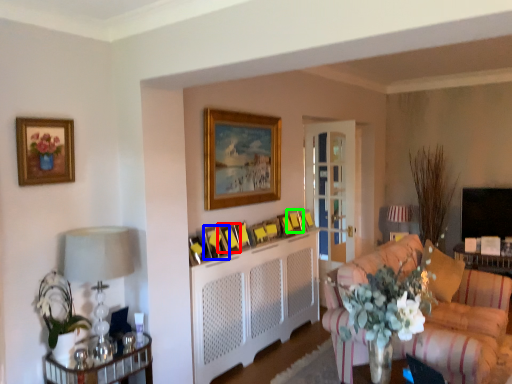
Question: Estimate the real-world distances between objects in this image. Which object is farther from picture frame (highlighted by a red box), picture frame (highlighted by a blue box) or picture frame (highlighted by a green box)?

Choices:
 (A) picture frame
 (B) picture frame

Answer: (B)